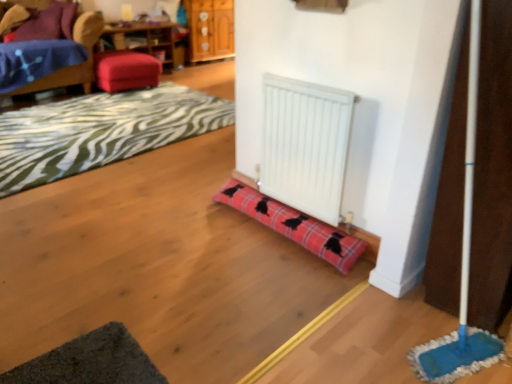
Find the location of a particular element. This screenshot has height=384, width=512. free space above dark gray textured yoga mat at lower left (from a real-world perspective) is located at coordinates (91, 361).